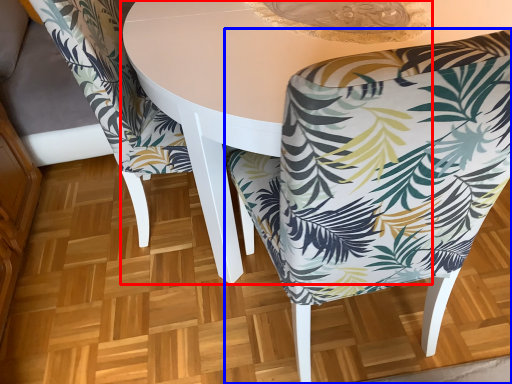
Question: Which object is further to the camera taking this photo, round table (highlighted by a red box) or chair (highlighted by a blue box)?

Choices:
 (A) round table
 (B) chair

Answer: (A)